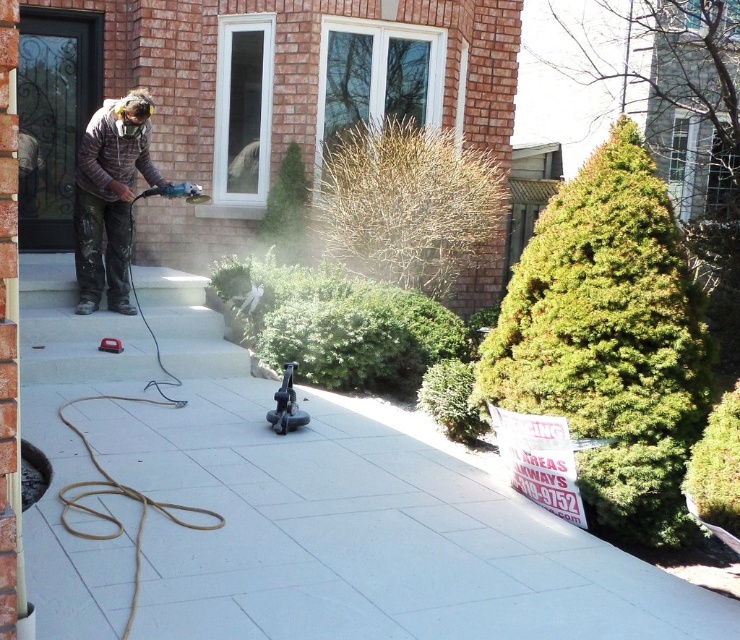
Question: Is white concrete pavement at center wider than camouflage jacket at center?

Choices:
 (A) yes
 (B) no

Answer: (A)

Question: Does white concrete pavement at center appear on the left side of camouflage jacket at center?

Choices:
 (A) yes
 (B) no

Answer: (B)

Question: Considering the relative positions of white concrete pavement at center and camouflage jacket at center in the image provided, where is white concrete pavement at center located with respect to camouflage jacket at center?

Choices:
 (A) above
 (B) below

Answer: (B)

Question: Which point is closer to the camera taking this photo?

Choices:
 (A) (26, 401)
 (B) (144, 100)

Answer: (A)

Question: Among these points, which one is nearest to the camera?

Choices:
 (A) (445, 602)
 (B) (95, 260)

Answer: (A)